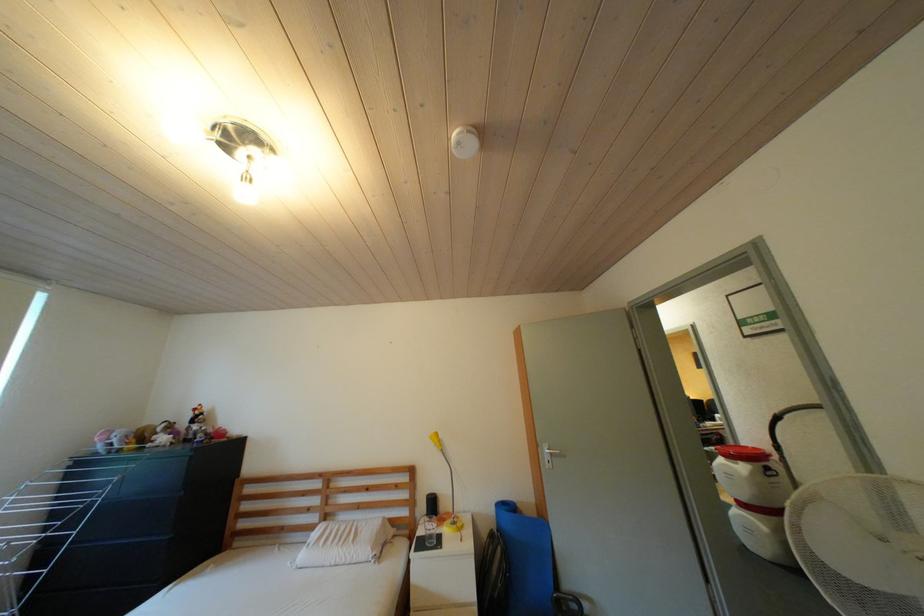
You are a GUI agent. You are given a task and a screenshot of the screen. Output one action in this format:
    pyautogui.click(x=<x>, y=<y>)
    Task: Click on the silver door handle
    The height and width of the screenshot is (616, 924).
    Given the screenshot: What is the action you would take?
    pyautogui.click(x=551, y=450)